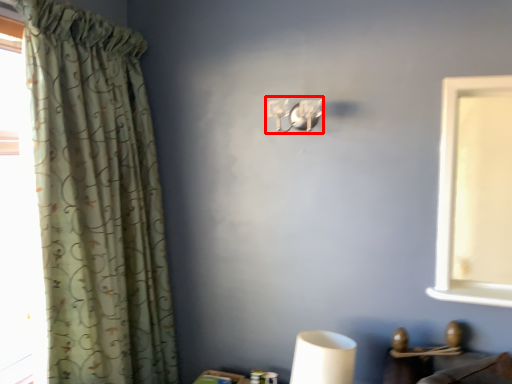
Question: Where is lamp (annotated by the red box) located in relation to curtain in the image?

Choices:
 (A) left
 (B) right

Answer: (B)